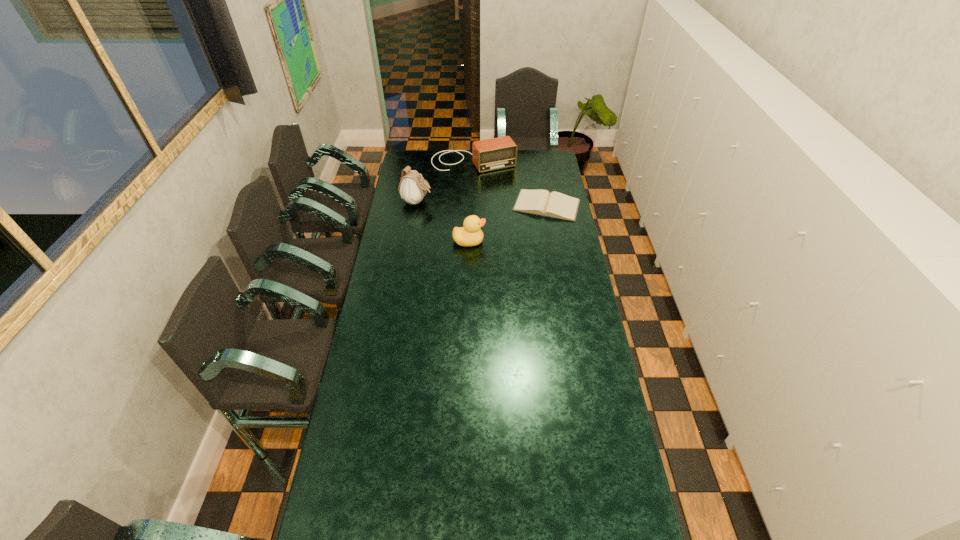
Locate an element on the screen. This screenshot has height=540, width=960. empty location between the radio receiver and the nearest object is located at coordinates (471, 201).

Find the location of a particular element. This screenshot has height=540, width=960. vacant space in between the Bible and the farthest object is located at coordinates (510, 184).

This screenshot has width=960, height=540. In order to click on object identified as the closest to the nearest object in this screenshot , I will do `click(539, 202)`.

Where is `object that is the nearest to the tallest object`? object that is the nearest to the tallest object is located at coordinates (497, 153).